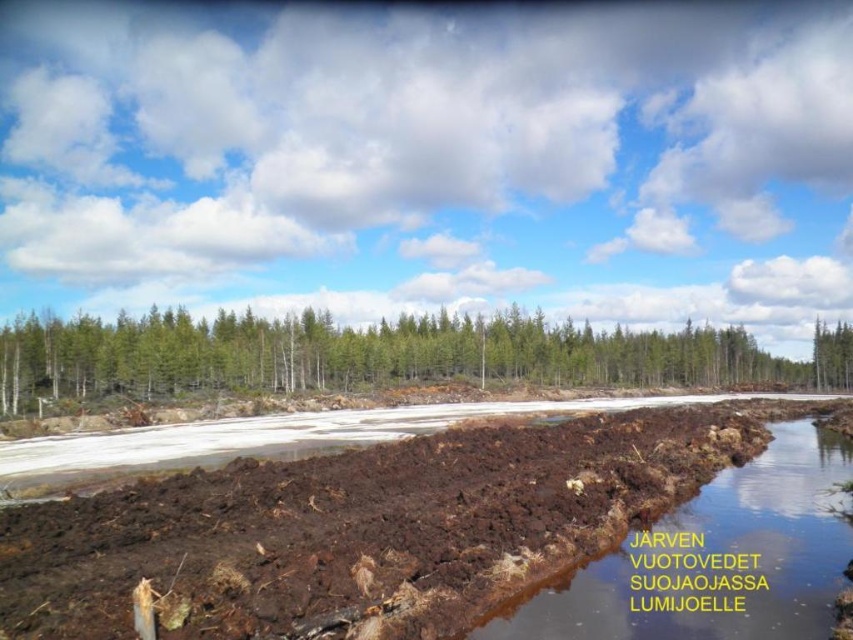
Question: Which point is closer to the camera taking this photo?

Choices:
 (A) (387, 612)
 (B) (666, 604)

Answer: (A)

Question: Observing the image, what is the correct spatial positioning of green matte trees at center in reference to brown muddy water at center?

Choices:
 (A) below
 (B) above

Answer: (B)

Question: Which object is the farthest from the green matte trees at center?

Choices:
 (A) brown muddy water at center
 (B) brown soil at center

Answer: (A)

Question: Can you confirm if green matte trees at center is bigger than brown muddy water at center?

Choices:
 (A) yes
 (B) no

Answer: (A)

Question: Among these objects, which one is farthest from the camera?

Choices:
 (A) brown muddy water at center
 (B) green matte trees at center
 (C) brown soil at center

Answer: (B)

Question: Can you confirm if brown soil at center is smaller than brown muddy water at center?

Choices:
 (A) yes
 (B) no

Answer: (B)